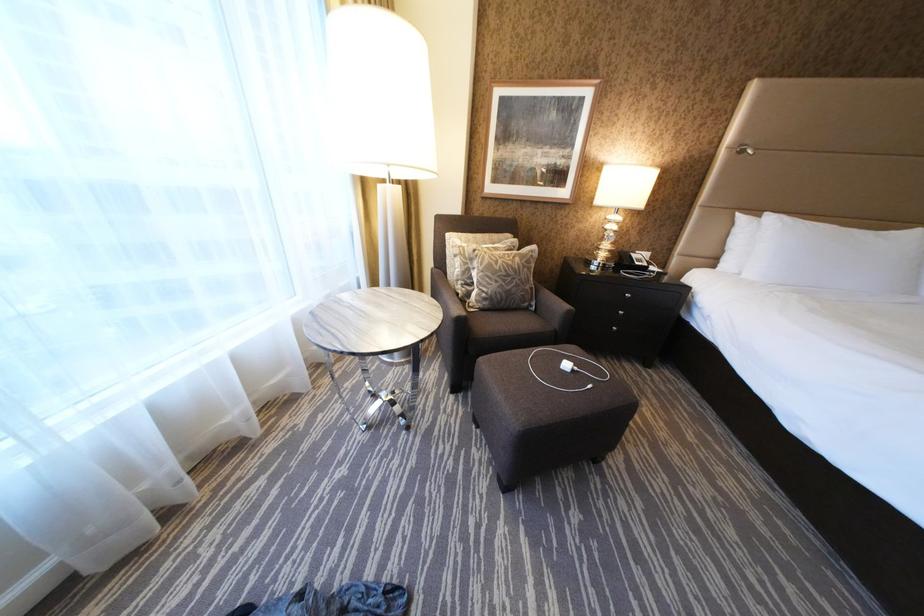
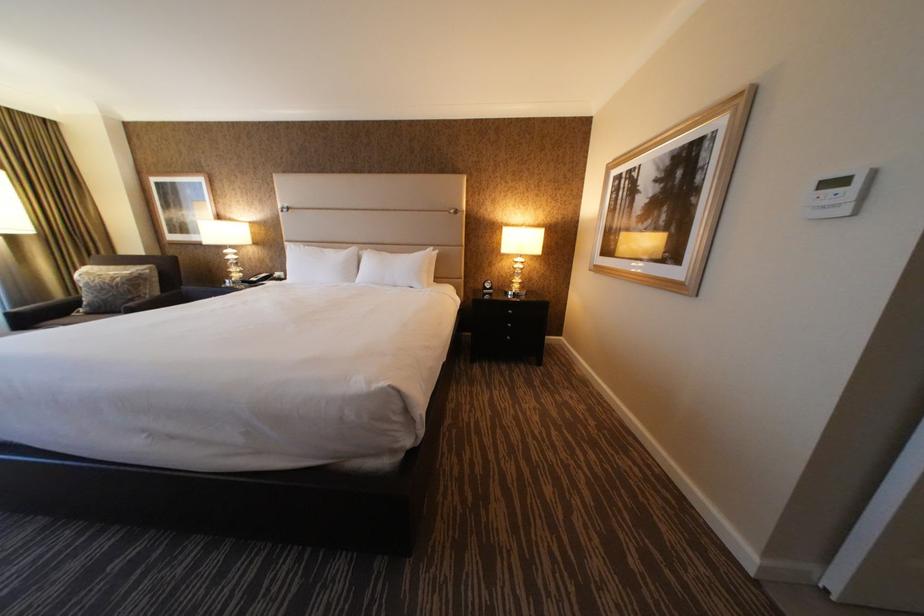
Question: In a continuous first-person perspective shot, in which direction is the camera moving?

Choices:
 (A) Left
 (B) Right
 (C) Forward
 (D) Backward

Answer: (B)